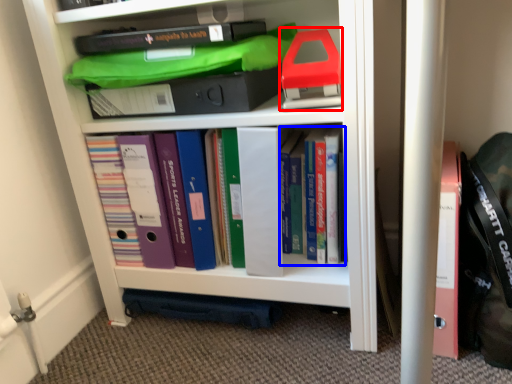
Question: Which object is closer to the camera taking this photo, book (highlighted by a red box) or book (highlighted by a blue box)?

Choices:
 (A) book
 (B) book

Answer: (A)